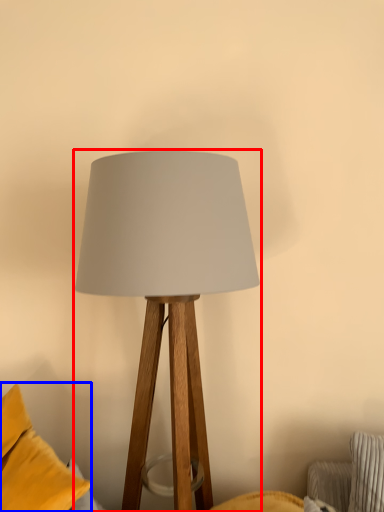
Question: Which point is further to the camera, lamp (highlighted by a red box) or pillow (highlighted by a blue box)?

Choices:
 (A) lamp
 (B) pillow

Answer: (A)